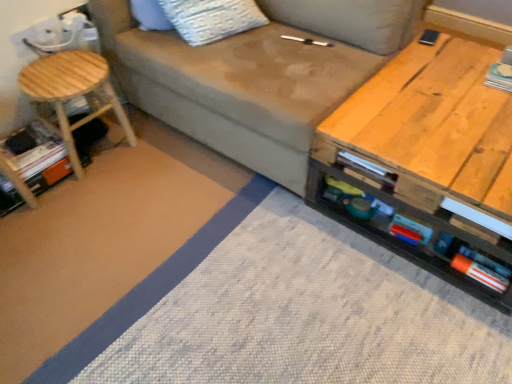
The height and width of the screenshot is (384, 512). Find the location of `vacant space behind white paper book at upper right, the 2th book positioned from the left`. vacant space behind white paper book at upper right, the 2th book positioned from the left is located at coordinates (476, 56).